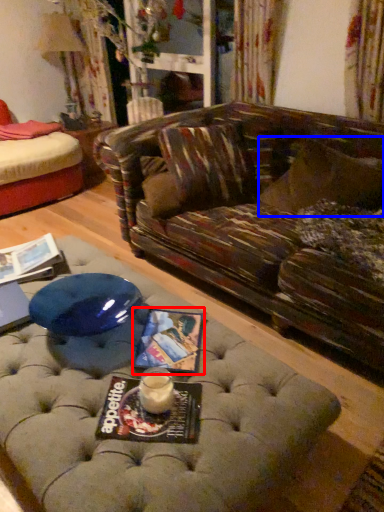
Question: Among these objects, which one is farthest to the camera, magazine (highlighted by a red box) or pillow (highlighted by a blue box)?

Choices:
 (A) magazine
 (B) pillow

Answer: (B)